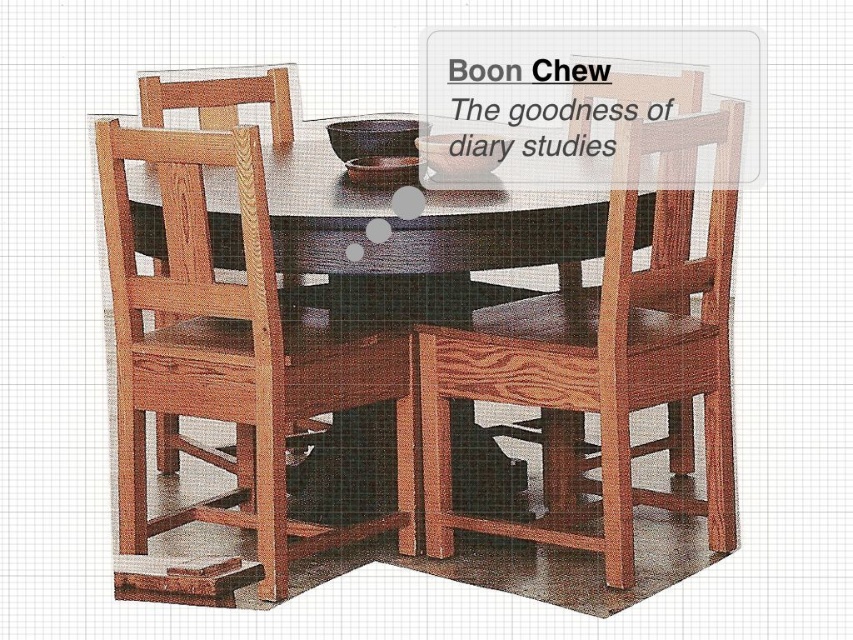
You are a guest at a dinner party and need to choose between the wooden chair at center and the natural wood chair at center. Which chair is taller?

The wooden chair at center is much taller than the natural wood chair at center.

You are hosting a dinner party and want to seat guests comfortably. Given the wooden chair at center and the wooden table at center, which one takes up more space in the dining area?

The wooden table at center takes up more space in the dining area since it is larger than the wooden chair at center.

You are standing in front of the dining table and want to pick up an object. Which of the two points, point (x=508, y=396) or point (x=277, y=138), is closer to you?

Point (x=508, y=396) is closer to the camera than point (x=277, y=138), so it is closer to you.